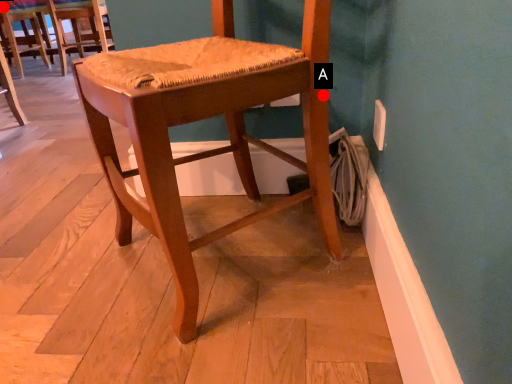
Question: Two points are circled on the image, labeled by A and B beside each circle. Which point appears farthest from the camera in this image?

Choices:
 (A) A is further
 (B) B is further

Answer: (B)